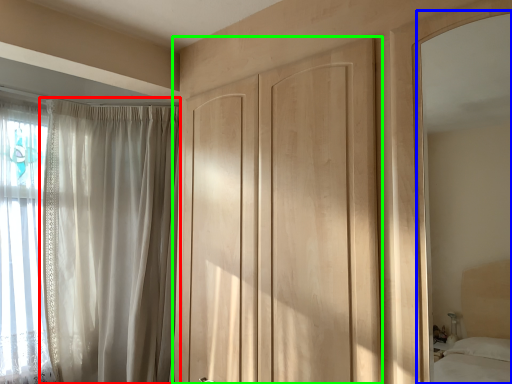
Question: Based on their relative distances, which object is farther from curtain (highlighted by a red box)? Choose from mirror (highlighted by a blue box) and door (highlighted by a green box).

Choices:
 (A) mirror
 (B) door

Answer: (A)